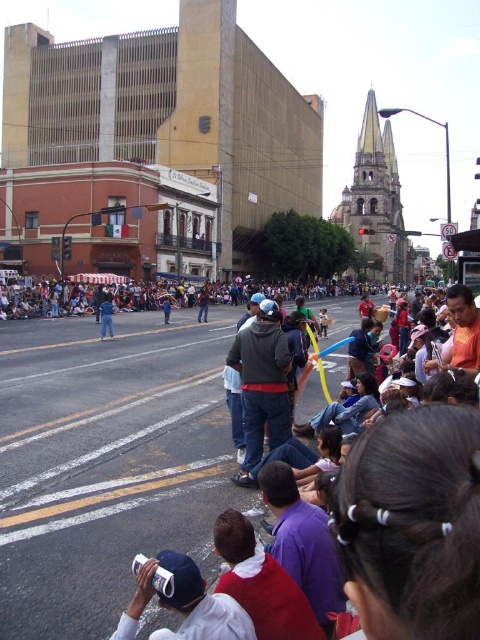
You are standing at the edge of the street and see two people in the middle of the road ahead. One is wearing a dark gray hoodie at center and the other a denim jacket at center. If you want to take a photo of the person on the left side of the two, which clothing item should you aim for?

The denim jacket at center is on the left side, so you should aim for the denim jacket at center.

Based on the photo, you are standing at the edge of the road in the lively street scene and want to take a photo of both the point at coordinates (245, 445) and the point at coordinates (175, 572). Which point should you focus on first to ensure both are in the frame?

You should focus on the point at coordinates (245, 445) first because it is closer to the camera than the point at coordinates (175, 572), ensuring both points remain in the frame.

You are a delivery drone operator. Your drone is currently above the white matte cap at lower center and needs to deliver a package to the denim jacket at center. The drone has a maximum flight range of 60 meters before needing to recharge. Can the drone safely make the delivery without needing to recharge?

The distance between the white matte cap at lower center and the denim jacket at center is 58.75 meters, which is within the drone operator maximum flight range of 60 meters. The drone can safely make the delivery without needing to recharge.